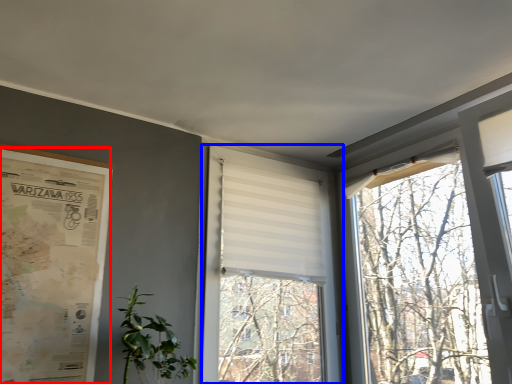
Question: Which of the following is the closest to the observer, poster page (highlighted by a red box) or window (highlighted by a blue box)?

Choices:
 (A) poster page
 (B) window

Answer: (A)